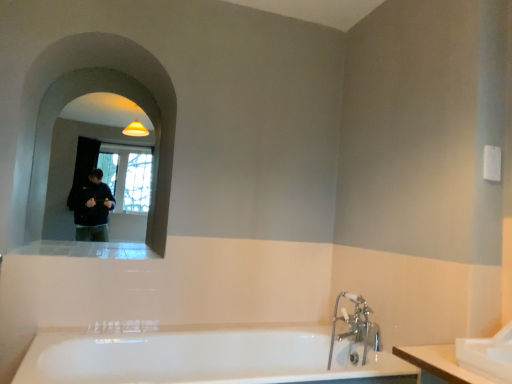
Question: Considering their positions, is chrome metallic faucet at lower right located in front of or behind white glossy bathtub at lower center?

Choices:
 (A) front
 (B) behind

Answer: (B)

Question: Considering the positions of chrome metallic faucet at lower right and white glossy bathtub at lower center in the image, is chrome metallic faucet at lower right wider or thinner than white glossy bathtub at lower center?

Choices:
 (A) thin
 (B) wide

Answer: (A)

Question: Considering the real-world distances, which object is closest to the matte glass mirror at upper left?

Choices:
 (A) white glossy sink at lower right
 (B) white glossy bathtub at lower center
 (C) chrome metallic faucet at lower right

Answer: (B)

Question: Which object is the farthest from the matte glass mirror at upper left?

Choices:
 (A) chrome metallic faucet at lower right
 (B) white glossy sink at lower right
 (C) white glossy bathtub at lower center

Answer: (B)